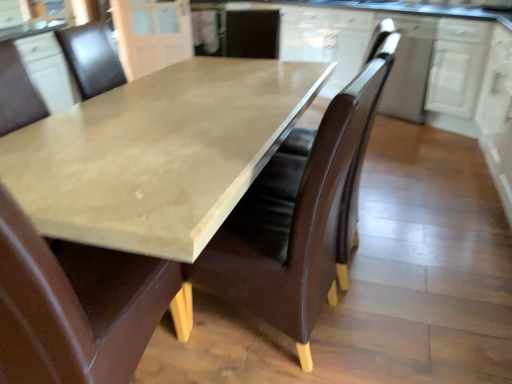
Find the location of a particular element. free location in front of brown leather swivel chair at center is located at coordinates (386, 333).